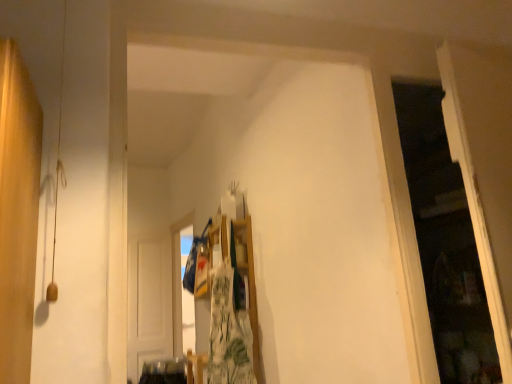
Question: Considering the relative positions of white wooden door at center and transparent plastic window at upper center in the image provided, is white wooden door at center to the left of transparent plastic window at upper center from the viewer's perspective?

Choices:
 (A) yes
 (B) no

Answer: (A)

Question: Could you tell me if white wooden door at center is facing transparent plastic window at upper center?

Choices:
 (A) yes
 (B) no

Answer: (A)

Question: From the image's perspective, is white wooden door at center under transparent plastic window at upper center?

Choices:
 (A) no
 (B) yes

Answer: (B)

Question: Is white wooden door at center further to the viewer compared to transparent plastic window at upper center?

Choices:
 (A) no
 (B) yes

Answer: (B)

Question: Considering the relative sizes of white wooden door at center and transparent plastic window at upper center in the image provided, is white wooden door at center smaller than transparent plastic window at upper center?

Choices:
 (A) yes
 (B) no

Answer: (A)

Question: Does point (180, 311) appear closer or farther from the camera than point (126, 372)?

Choices:
 (A) closer
 (B) farther

Answer: (B)

Question: Is transparent plastic window at upper center to the left or to the right of white wooden door at center in the image?

Choices:
 (A) right
 (B) left

Answer: (A)

Question: From the image's perspective, is transparent plastic window at upper center located above or below white wooden door at center?

Choices:
 (A) above
 (B) below

Answer: (A)

Question: In terms of size, does transparent plastic window at upper center appear bigger or smaller than white wooden door at center?

Choices:
 (A) big
 (B) small

Answer: (A)

Question: From a real-world perspective, is green floral fabric at center physically located above or below white wooden door at center?

Choices:
 (A) above
 (B) below

Answer: (A)

Question: Considering the positions of point (224, 291) and point (146, 283), is point (224, 291) closer or farther from the camera than point (146, 283)?

Choices:
 (A) farther
 (B) closer

Answer: (B)

Question: From their relative heights in the image, would you say green floral fabric at center is taller or shorter than white wooden door at center?

Choices:
 (A) tall
 (B) short

Answer: (B)

Question: Is green floral fabric at center bigger or smaller than white wooden door at center?

Choices:
 (A) big
 (B) small

Answer: (B)

Question: Considering the positions of point (245, 309) and point (172, 225), is point (245, 309) closer or farther from the camera than point (172, 225)?

Choices:
 (A) farther
 (B) closer

Answer: (B)

Question: Considering the positions of green floral fabric at center and transparent plastic window at upper center in the image, is green floral fabric at center taller or shorter than transparent plastic window at upper center?

Choices:
 (A) short
 (B) tall

Answer: (A)